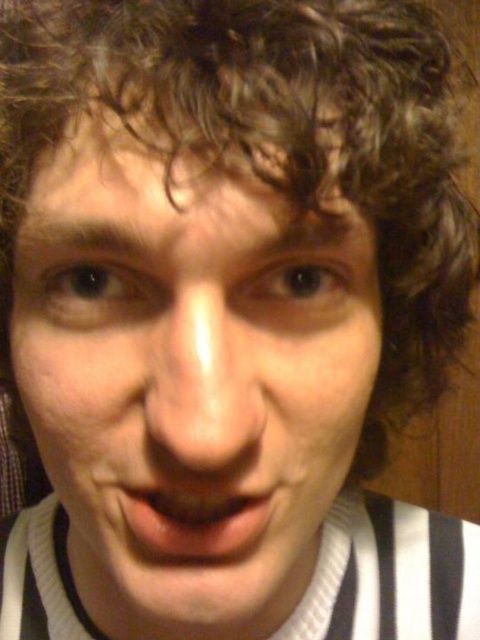
Can you confirm if smooth skin nose at center is shorter than glossy pink lips at center?

No.

Is smooth skin nose at center behind glossy pink lips at center?

No.

The width and height of the screenshot is (480, 640). I want to click on smooth skin nose at center, so click(202, 384).

Is smooth skin face at center above glossy pink lips at center?

Indeed, smooth skin face at center is positioned over glossy pink lips at center.

At what (x,y) coordinates should I click in order to perform the action: click on smooth skin face at center. Please return your answer as a coordinate pair (x, y). This screenshot has height=640, width=480. Looking at the image, I should click on (188, 380).

Find the location of `smooth skin face at center`. smooth skin face at center is located at coordinates (188, 380).

Which is in front, point (106, 449) or point (182, 292)?

Point (182, 292) is in front.

Is smooth skin face at center smaller than smooth skin nose at center?

No, smooth skin face at center is not smaller than smooth skin nose at center.

Between point (206, 250) and point (186, 307), which one is positioned in front?

Point (206, 250) is more forward.

The width and height of the screenshot is (480, 640). I want to click on smooth skin face at center, so click(x=188, y=380).